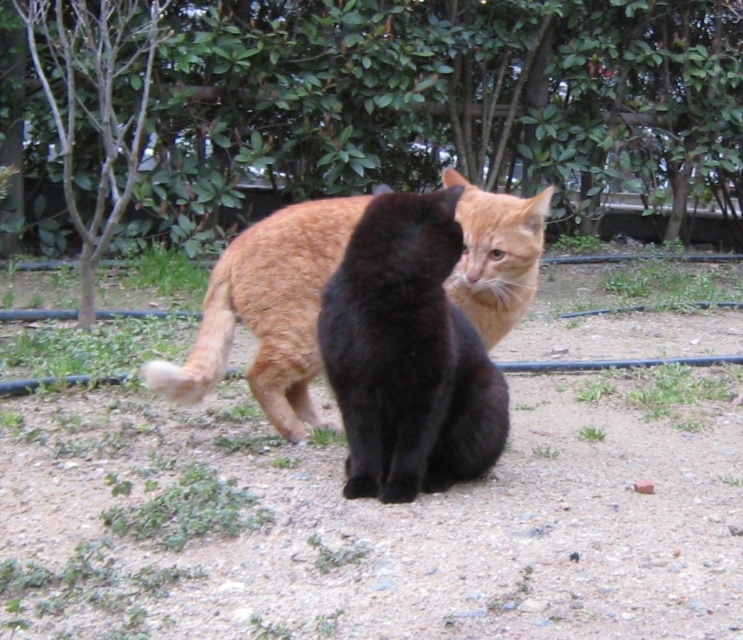
Question: Considering the relative positions of black fur cat at center and orange fur cat at center in the image provided, where is black fur cat at center located with respect to orange fur cat at center?

Choices:
 (A) above
 (B) below

Answer: (B)

Question: Among these objects, which one is farthest from the camera?

Choices:
 (A) black fur cat at center
 (B) orange fur cat at center

Answer: (B)

Question: Is black fur cat at center wider than orange fur cat at center?

Choices:
 (A) yes
 (B) no

Answer: (B)

Question: Is black fur cat at center positioned at the back of orange fur cat at center?

Choices:
 (A) yes
 (B) no

Answer: (B)

Question: Which point is farther to the camera?

Choices:
 (A) black fur cat at center
 (B) orange fur cat at center

Answer: (B)

Question: Which object appears closest to the camera in this image?

Choices:
 (A) orange fur cat at center
 (B) black fur cat at center

Answer: (B)